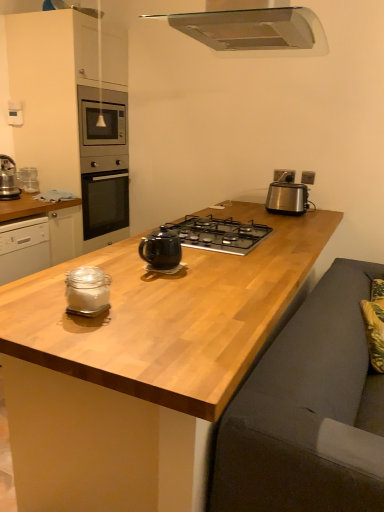
What are the coordinates of `unoccupied space behind clear glass jar at center` in the screenshot? It's located at (130, 285).